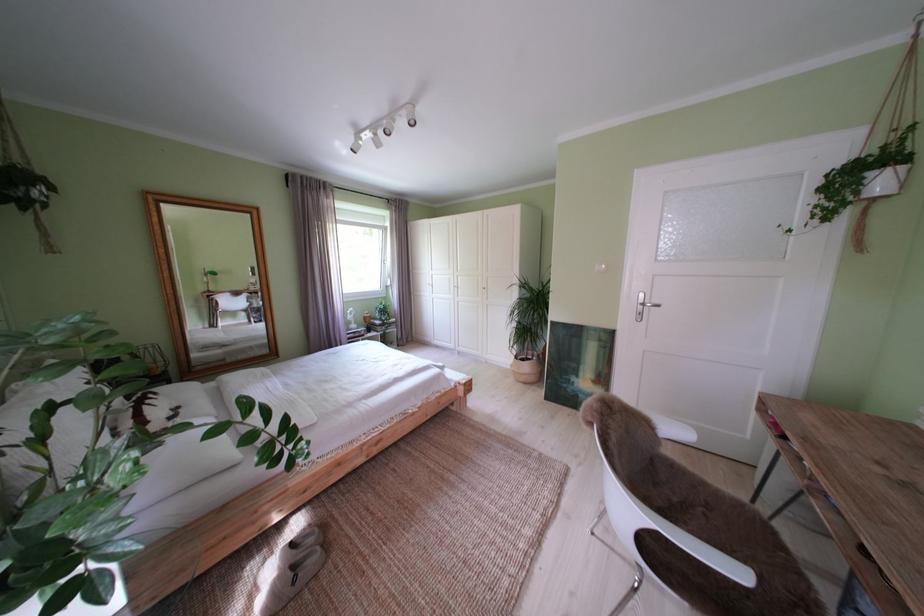
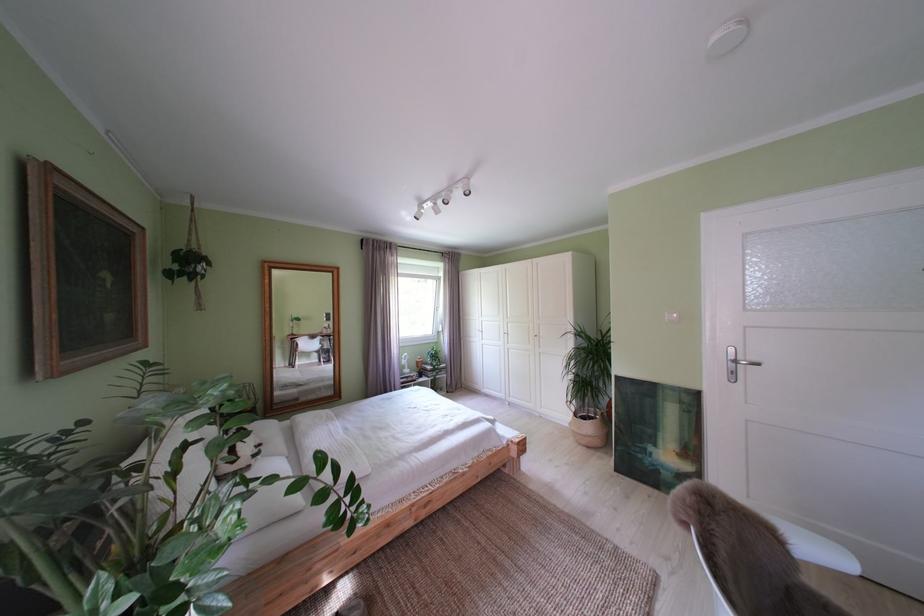
Where in the second image is the point corresponding to pixel 527 363 from the first image?

(587, 419)